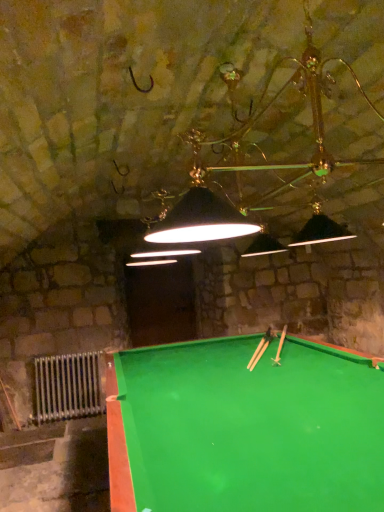
Locate an element on the screen. free space underneath green plastic cue at center, which is counted as the 2th cue, starting from the bottom (from a real-world perspective) is located at coordinates (288, 347).